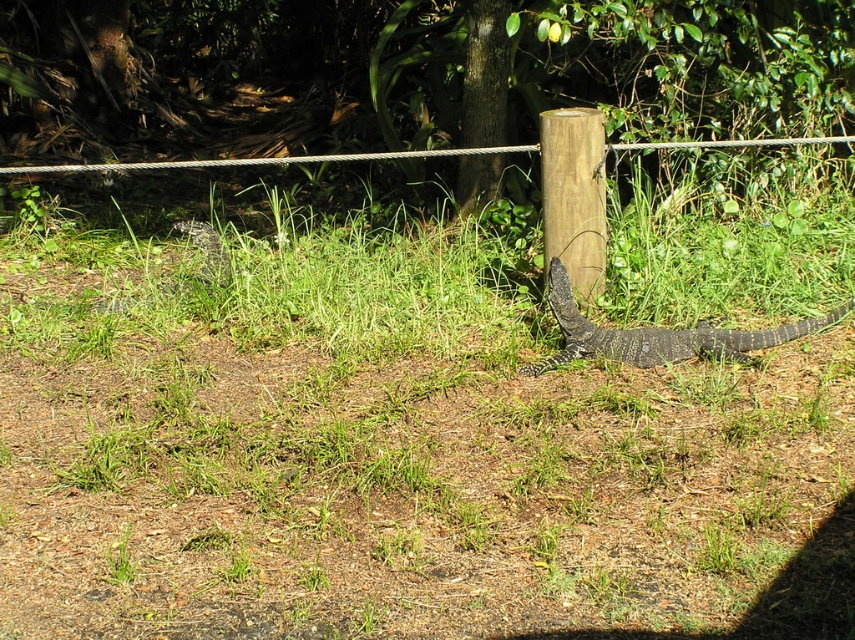
You are a wildlife photographer aiming to capture both the dark gray scaly lizard at lower right and the dark gray scaly lizard at center in the same frame. Based on their positions, which lizard is closer to the ground?

The dark gray scaly lizard at lower right is below dark gray scaly lizard at center, so it is closer to the ground.

You are a wildlife photographer trying to capture both the dark gray scaly lizard at lower right and the dark gray scaly lizard at center in a single photo. Which lizard should you focus on first to ensure both are in frame?

You should focus on the dark gray scaly lizard at lower right first because it is larger in size than the dark gray scaly lizard at center, so it will require more space in the frame to capture its full body.